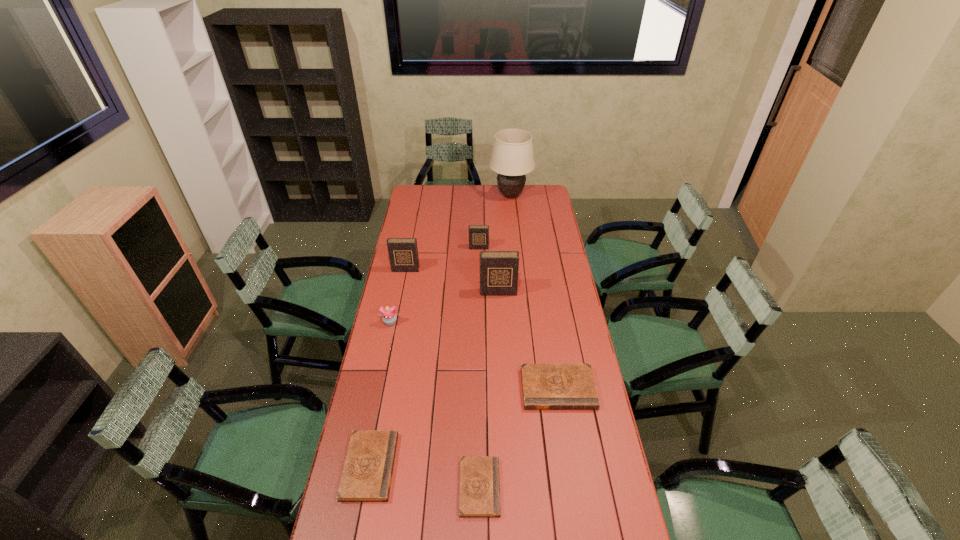
The image size is (960, 540). Find the location of `lampshade`. lampshade is located at coordinates (512, 157).

You are a GUI agent. You are given a task and a screenshot of the screen. Output one action in this format:
    pyautogui.click(x=<x>, y=<y>)
    Task: Click on the farthest object
    Image resolution: width=960 pixels, height=540 pixels.
    Given the screenshot: What is the action you would take?
    pyautogui.click(x=512, y=157)

Where is `the seventh shortest object`? the seventh shortest object is located at coordinates (499, 270).

Where is `the third farthest diary`? the third farthest diary is located at coordinates (499, 270).

This screenshot has height=540, width=960. What are the coordinates of `the sixth nearest object` in the screenshot? It's located at (403, 253).

Identify the location of the second biggest dark diary. (403, 253).

At what (x,y) coordinates should I click in order to perform the action: click on the smallest dark diary. Please return your answer as a coordinate pair (x, y). This screenshot has width=960, height=540. Looking at the image, I should click on (478, 234).

Identify the location of the third tallest diary. This screenshot has width=960, height=540. (478, 234).

You are a GUI agent. You are given a task and a screenshot of the screen. Output one action in this format:
    pyautogui.click(x=<x>, y=<y>)
    Task: Click on the cupcake
    
    Given the screenshot: What is the action you would take?
    pyautogui.click(x=389, y=317)

In order to click on the fourth nearest object in this screenshot , I will do `click(389, 317)`.